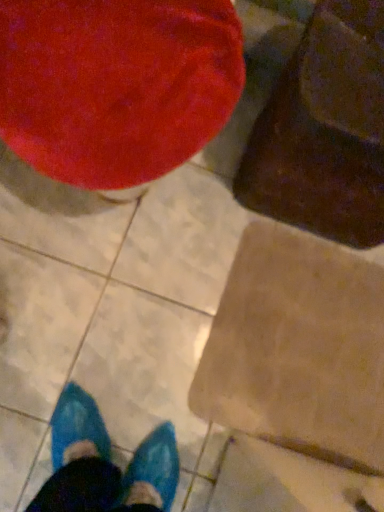
Question: Is velvety brown bean bag chair at upper right, the second bean bag chair viewed from the left, beside velvet red bean bag chair at upper left, the first bean bag chair viewed from the left?

Choices:
 (A) yes
 (B) no

Answer: (B)

Question: Is velvety brown bean bag chair at upper right, the second bean bag chair viewed from the left, aimed at velvet red bean bag chair at upper left, acting as the second bean bag chair starting from the right?

Choices:
 (A) no
 (B) yes

Answer: (A)

Question: Can you confirm if velvety brown bean bag chair at upper right, the second bean bag chair viewed from the left, is thinner than velvet red bean bag chair at upper left, acting as the second bean bag chair starting from the right?

Choices:
 (A) no
 (B) yes

Answer: (B)

Question: Are velvety brown bean bag chair at upper right, the second bean bag chair viewed from the left, and velvet red bean bag chair at upper left, acting as the second bean bag chair starting from the right, located far from each other?

Choices:
 (A) yes
 (B) no

Answer: (B)

Question: Does velvety brown bean bag chair at upper right, the second bean bag chair viewed from the left, have a lesser height compared to velvet red bean bag chair at upper left, acting as the second bean bag chair starting from the right?

Choices:
 (A) yes
 (B) no

Answer: (A)

Question: From a real-world perspective, is velvety brown bean bag chair at upper right, placed as the 1th bean bag chair when sorted from right to left, positioned above or below velvet red bean bag chair at upper left, the first bean bag chair viewed from the left?

Choices:
 (A) above
 (B) below

Answer: (B)

Question: Relative to velvet red bean bag chair at upper left, the first bean bag chair viewed from the left, is velvety brown bean bag chair at upper right, placed as the 1th bean bag chair when sorted from right to left, in front or behind?

Choices:
 (A) behind
 (B) front

Answer: (A)

Question: Is point (350, 97) closer or farther from the camera than point (86, 118)?

Choices:
 (A) closer
 (B) farther

Answer: (A)

Question: From the image's perspective, is velvety brown bean bag chair at upper right, the second bean bag chair viewed from the left, located above or below velvet red bean bag chair at upper left, the first bean bag chair viewed from the left?

Choices:
 (A) below
 (B) above

Answer: (A)

Question: Considering the positions of point (332, 162) and point (299, 296), is point (332, 162) closer or farther from the camera than point (299, 296)?

Choices:
 (A) farther
 (B) closer

Answer: (B)

Question: Considering their positions, is velvety brown bean bag chair at upper right, the second bean bag chair viewed from the left, located in front of or behind brown cardboard at lower right?

Choices:
 (A) behind
 (B) front

Answer: (B)

Question: From a real-world perspective, relative to brown cardboard at lower right, is velvety brown bean bag chair at upper right, the second bean bag chair viewed from the left, vertically above or below?

Choices:
 (A) above
 (B) below

Answer: (A)

Question: Is velvety brown bean bag chair at upper right, the second bean bag chair viewed from the left, bigger or smaller than brown cardboard at lower right?

Choices:
 (A) big
 (B) small

Answer: (A)

Question: Does point (339, 267) appear closer or farther from the camera than point (125, 117)?

Choices:
 (A) closer
 (B) farther

Answer: (B)

Question: From their relative heights in the image, would you say brown cardboard at lower right is taller or shorter than velvet red bean bag chair at upper left, acting as the second bean bag chair starting from the right?

Choices:
 (A) short
 (B) tall

Answer: (A)